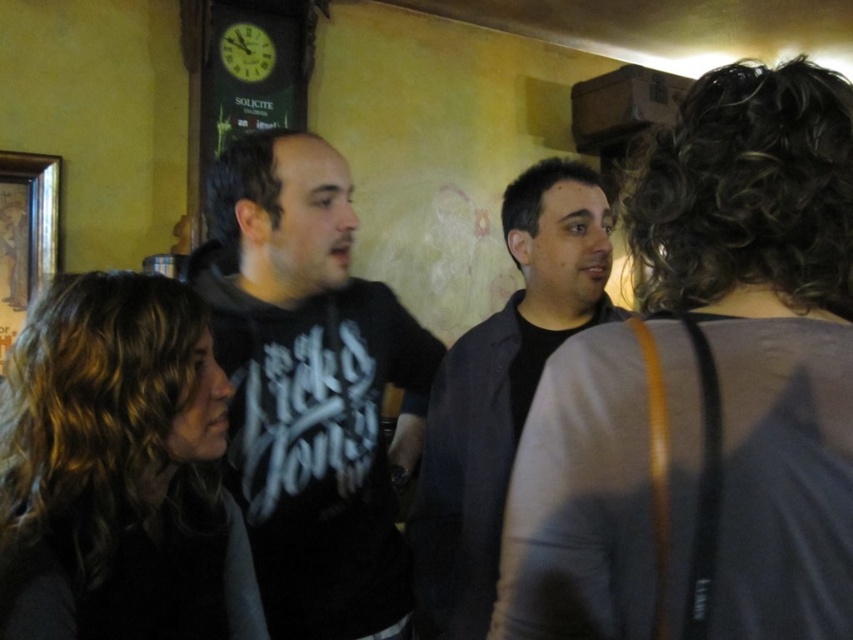
Looking at this image, can you confirm if dark brown hair at center is wider than black matte shirt at center?

No.

Does dark brown hair at center appear on the left side of black matte shirt at center?

Correct, you'll find dark brown hair at center to the left of black matte shirt at center.

Is point (55, 502) behind point (212, 308)?

No.

The width and height of the screenshot is (853, 640). What are the coordinates of `dark brown hair at center` in the screenshot? It's located at (119, 470).

Is point (242, 282) closer to viewer compared to point (593, 236)?

Yes, point (242, 282) is in front of point (593, 236).

Is black matte shirt at center thinner than dark gray jacket at center?

Correct, black matte shirt at center's width is less than dark gray jacket at center's.

Who is more forward, (225, 160) or (494, 340)?

→ Point (225, 160)

Identify the location of black matte shirt at center. (309, 388).

You are a GUI agent. You are given a task and a screenshot of the screen. Output one action in this format:
    pyautogui.click(x=<x>, y=<y>)
    Task: Click on the dark brown hair at center
    Image resolution: width=853 pixels, height=640 pixels.
    Given the screenshot: What is the action you would take?
    pyautogui.click(x=119, y=470)

What do you see at coordinates (119, 470) in the screenshot? I see `dark brown hair at center` at bounding box center [119, 470].

Which is in front, point (71, 314) or point (572, 164)?

Point (71, 314) is more forward.

Identify the location of dark brown hair at center. Image resolution: width=853 pixels, height=640 pixels. pos(119,470).